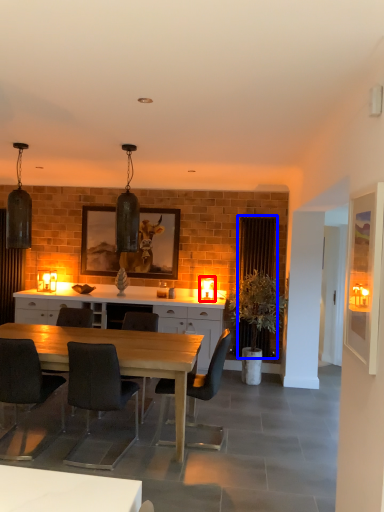
Question: Which point is further to the camera, lamp (highlighted by a red box) or curtain (highlighted by a blue box)?

Choices:
 (A) lamp
 (B) curtain

Answer: (A)